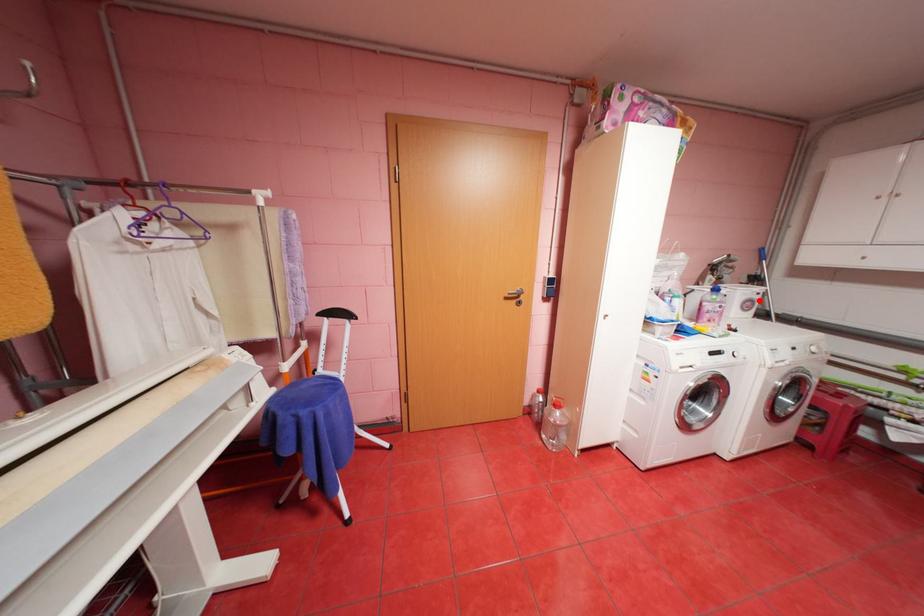
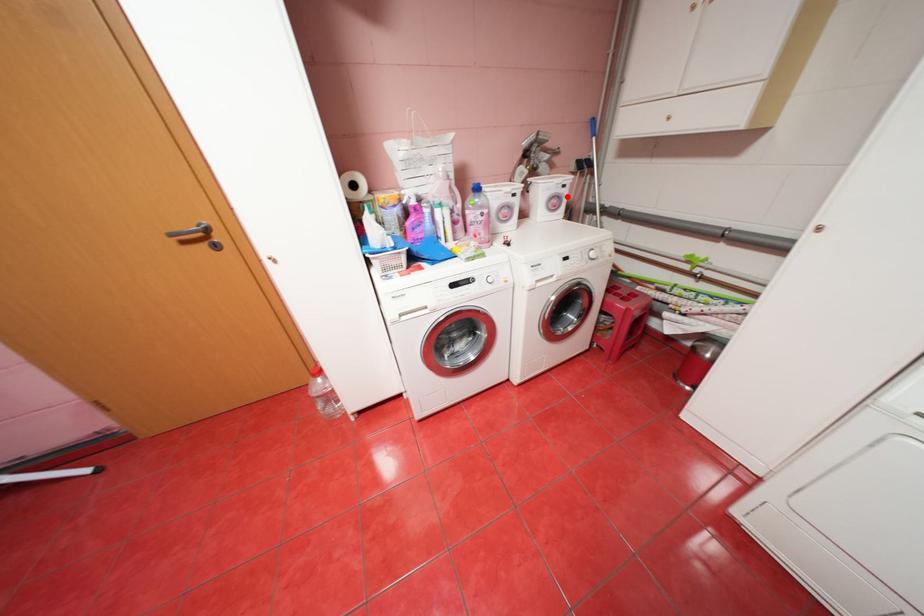
Looking at this image, I am providing you with two images of the same scene from different viewpoints. A red point is marked on the first image and another point is marked on the second image. Are the points marked in image1 and image2 representing the same 3D position?

Yes